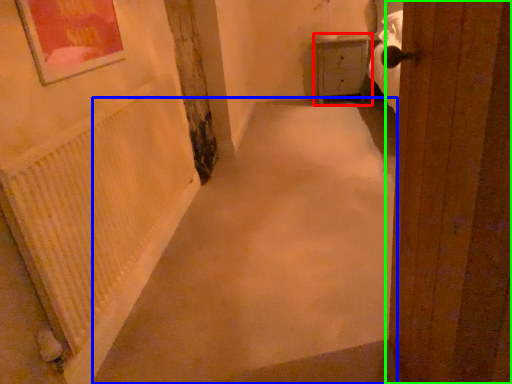
Question: Estimate the real-world distances between objects in this image. Which object is closer to furniture (highlighted by a red box), alley (highlighted by a blue box) or door (highlighted by a green box)?

Choices:
 (A) alley
 (B) door

Answer: (A)